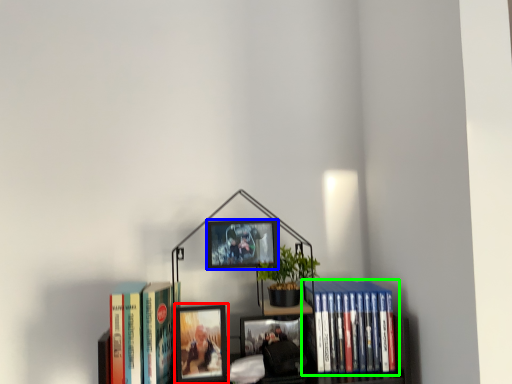
Question: Based on their relative distances, which object is farther from picture frame (highlighted by a red box)? Choose from picture frame (highlighted by a blue box) and book (highlighted by a green box).

Choices:
 (A) picture frame
 (B) book

Answer: (B)